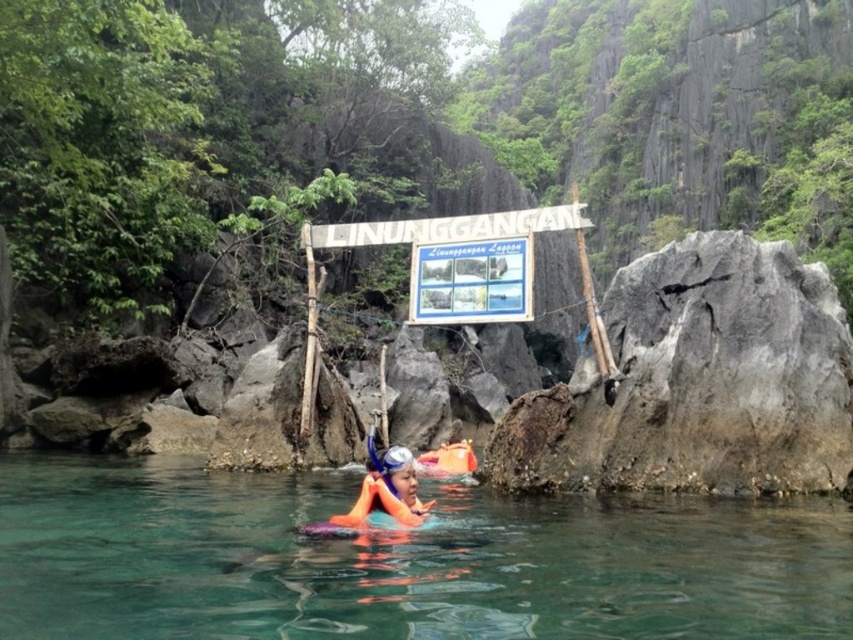
You are a swimmer trying to locate your orange life jacket at center while floating in the clear water at center. Which direction should you look to find it?

The orange life jacket at center is to the right of the clear water at center, so you should look to your right to find it.

You are a park ranger inspecting the area. You notice both the white plastic sign at center and the orange life jacket at center. Which object takes up more space visually in the scene?

The white plastic sign at center is larger in size than the orange life jacket at center, so the white plastic sign at center takes up more space visually in the scene.